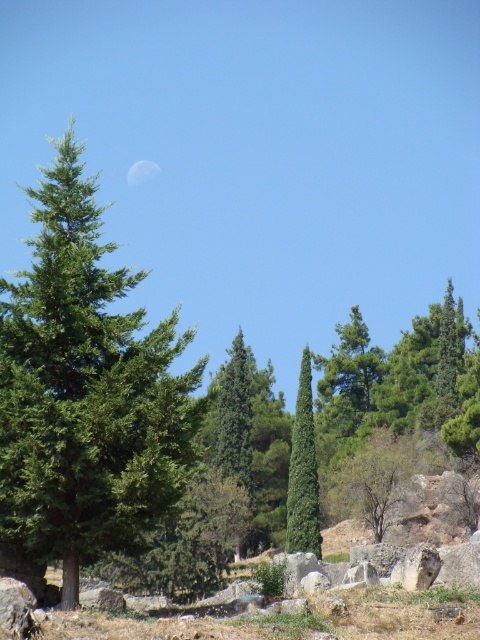
You are standing at the base of the tall cypress tree in the image. You notice a point marked at coordinates (85,388). What is located at that point?

At point (85,388) lies green needle like at center.